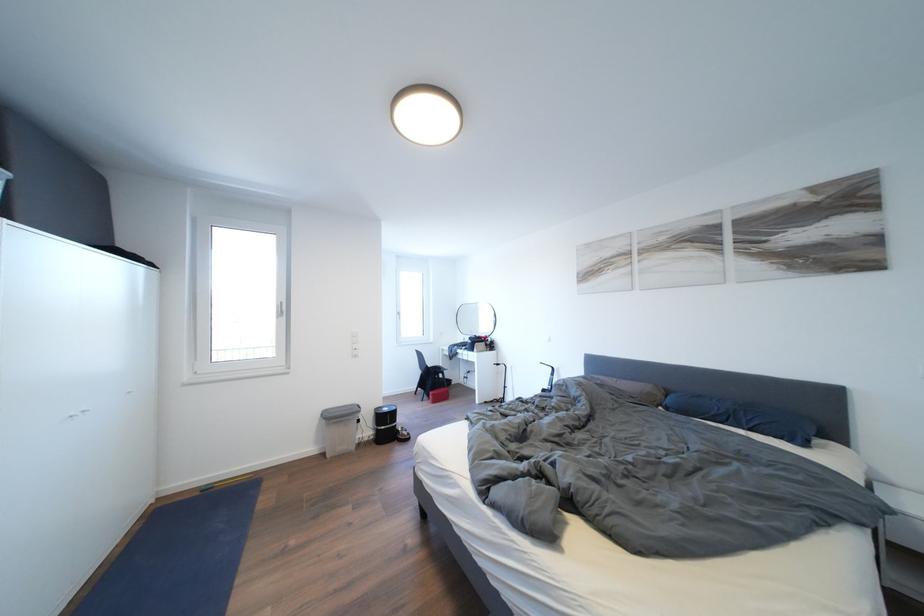
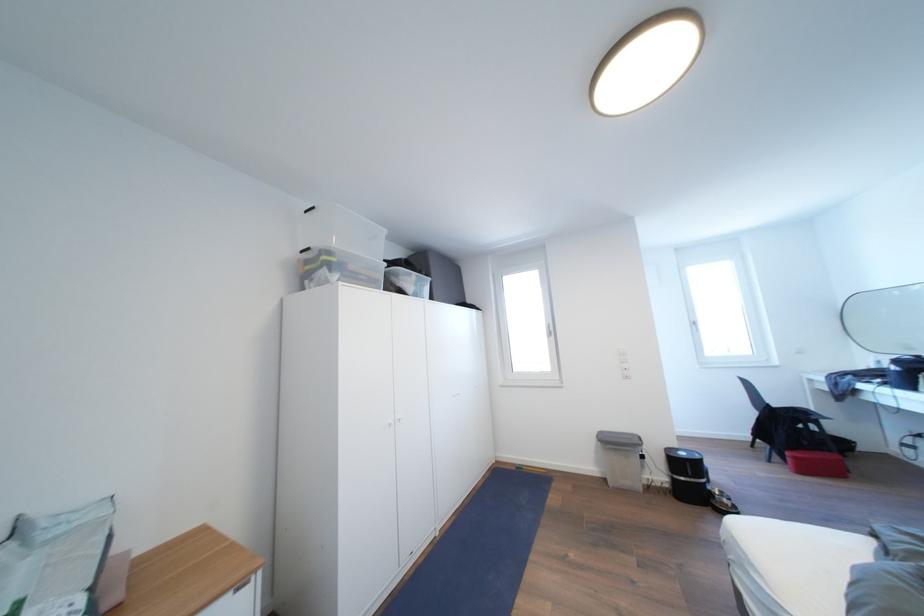
The point at (394, 414) is marked in the first image. Where is the corresponding point in the second image?

(689, 459)